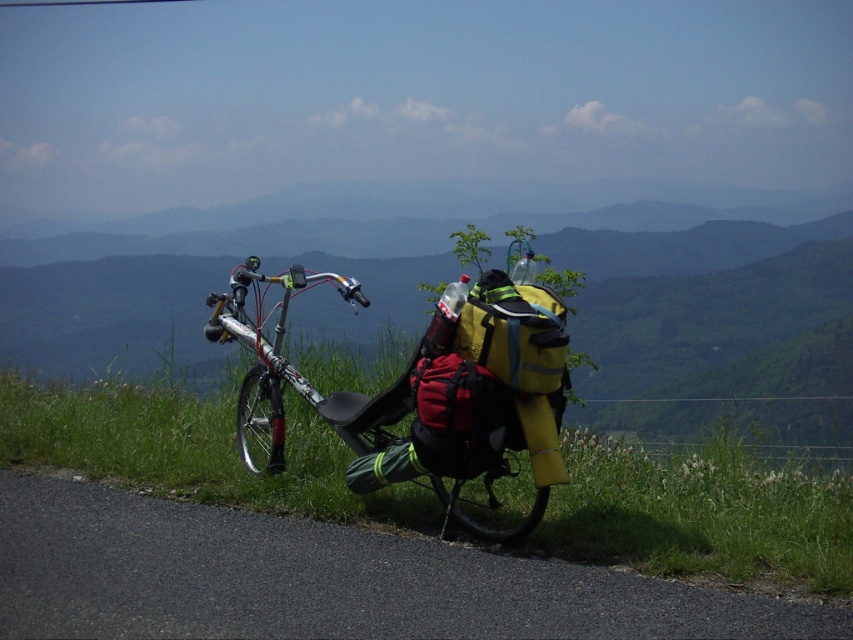
You are standing on the paved road and want to place a 3.5 feet long ladder between the green grass at lower left and the silver metallic bicycle at center. Is there enough space to place the ladder horizontally without it overlapping either object?

The green grass at lower left is 4.51 feet away from the silver metallic bicycle at center. Since the ladder is 3.5 feet long, which is shorter than the distance between them, there is enough space to place the ladder horizontally between them without overlapping either object.

You are a cyclist planning to ride your silver metallic bicycle at center from the current position. The black asphalt road at lower left is your intended path. Is the road visible and accessible for starting your ride?

The black asphalt road at lower left is in front of the silver metallic bicycle at center, so the road is visible and accessible for starting the ride.

You are a photographer planning to capture the silver metallic bicycle at center in your shot. Considering the green grass at lower left, which area should you focus on to ensure the bicycle is the main subject?

The silver metallic bicycle at center occupies more space than the green grass at lower left, so focusing on the area where the bicycle is located will ensure it becomes the main subject.